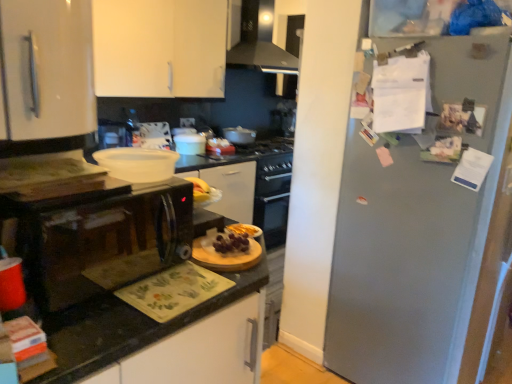
Question: Should I look upward or downward to see white matte cabinet at upper left?

Choices:
 (A) down
 (B) up

Answer: (B)

Question: Is metallic gray refrigerator at right closer to the viewer compared to white glossy pot at center, the first appliance from the front?

Choices:
 (A) yes
 (B) no

Answer: (A)

Question: Is metallic gray refrigerator at right bigger than white glossy pot at center, acting as the first appliance starting from the left?

Choices:
 (A) no
 (B) yes

Answer: (B)

Question: Can you confirm if metallic gray refrigerator at right is wider than white glossy pot at center, the first appliance from the front?

Choices:
 (A) no
 (B) yes

Answer: (B)

Question: Is metallic gray refrigerator at right at the right side of white glossy pot at center, acting as the first appliance starting from the left?

Choices:
 (A) yes
 (B) no

Answer: (A)

Question: From a real-world perspective, is metallic gray refrigerator at right physically above white glossy pot at center, placed as the third appliance when sorted from back to front?

Choices:
 (A) no
 (B) yes

Answer: (A)

Question: Is metallic gray refrigerator at right not inside white glossy pot at center, acting as the first appliance starting from the left?

Choices:
 (A) yes
 (B) no

Answer: (A)

Question: Is slightly glossy wooden cutting board at center, arranged as the 2th food when viewed from the left, next to white matte cabinet at upper left?

Choices:
 (A) yes
 (B) no

Answer: (B)

Question: Is slightly glossy wooden cutting board at center, placed as the 1th food when sorted from front to back, not inside white matte cabinet at upper left?

Choices:
 (A) no
 (B) yes

Answer: (B)

Question: Is the depth of slightly glossy wooden cutting board at center, arranged as the 2th food when viewed from the back, greater than that of white matte cabinet at upper left?

Choices:
 (A) no
 (B) yes

Answer: (A)

Question: Does slightly glossy wooden cutting board at center, the first food in the bottom-to-top sequence, have a lesser width compared to white matte cabinet at upper left?

Choices:
 (A) yes
 (B) no

Answer: (A)

Question: Would you say slightly glossy wooden cutting board at center, placed as the 1th food when sorted from front to back, contains white matte cabinet at upper left?

Choices:
 (A) no
 (B) yes

Answer: (A)

Question: From the image's perspective, would you say white matte cabinet at upper left is shown under matte white pot at center, which is the second appliance from back to front?

Choices:
 (A) no
 (B) yes

Answer: (A)